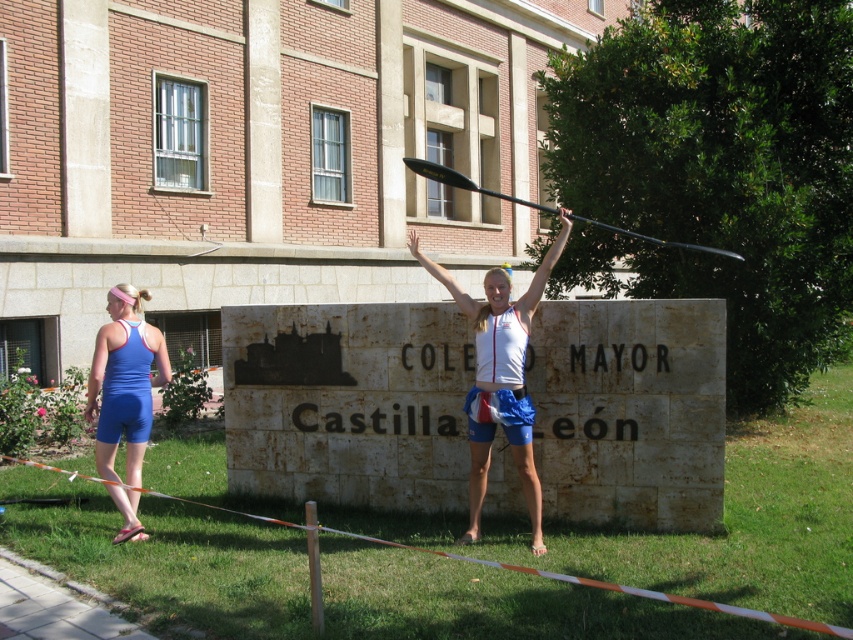
You are a photographer trying to capture the perfect shot of the blue fabric shorts at left and the blonde hair at center. Since you want to emphasize the subject with more visual weight, which object should you focus on?

The blonde hair at center occupies more space than the blue fabric shorts at left, so focusing on the blonde hair at center would emphasize the subject with more visual weight.

You are a photographer standing at the base of the large stone sign. You want to capture a photo that includes both the pink fabric headband at upper left and the blonde hair at center. Given the distance between them, will you need to adjust your camera to a wider angle to fit both subjects into the frame?

The pink fabric headband at upper left and the blonde hair at center are 17.54 feet apart from each other. To capture both subjects in the same frame, you would need to adjust your camera to a wider angle to accommodate the distance between them.